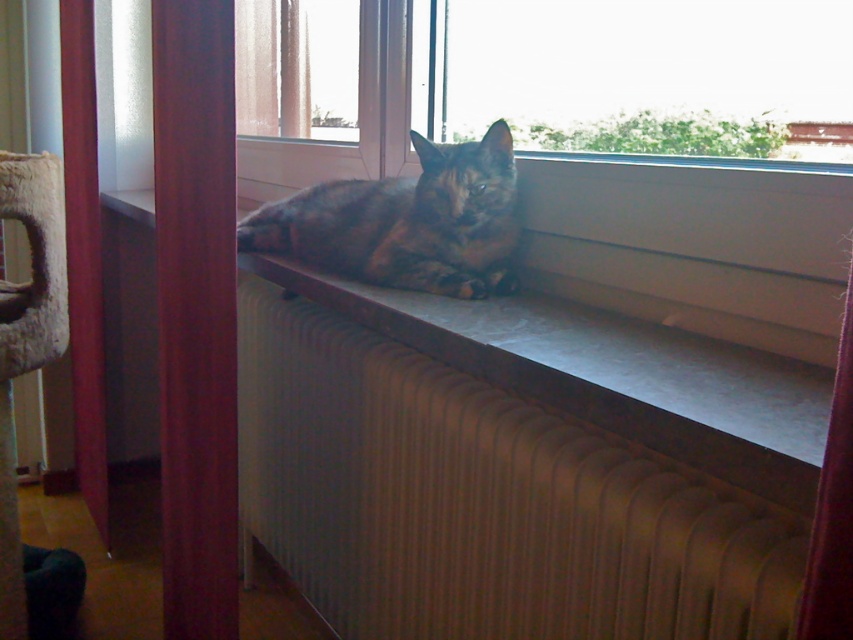
Looking at this image, between metallic radiator at lower center and transparent glass window at upper center, which one appears on the right side from the viewer's perspective?

transparent glass window at upper center is more to the right.

Between point (511, 432) and point (844, 60), which one is positioned behind?

Point (844, 60)

This screenshot has height=640, width=853. Find the location of `metallic radiator at lower center`. metallic radiator at lower center is located at coordinates (485, 500).

In the scene shown: Who is positioned more to the left, tortoiseshell fur cat at window or velvet red curtain at lower right?

tortoiseshell fur cat at window is more to the left.

Describe the element at coordinates (405, 221) in the screenshot. The width and height of the screenshot is (853, 640). I see `tortoiseshell fur cat at window` at that location.

Is point (312, 193) positioned behind point (814, 579)?

That is True.

You are a GUI agent. You are given a task and a screenshot of the screen. Output one action in this format:
    pyautogui.click(x=<x>, y=<y>)
    Task: Click on the tortoiseshell fur cat at window
    The height and width of the screenshot is (640, 853).
    Given the screenshot: What is the action you would take?
    pyautogui.click(x=405, y=221)

Is metallic radiator at lower center smaller than velvet red curtain at lower right?

Incorrect, metallic radiator at lower center is not smaller in size than velvet red curtain at lower right.

Is point (352, 342) positioned behind point (828, 490)?

Yes, it is.

Does point (248, 300) come behind point (848, 616)?

Yes, point (248, 300) is farther from viewer.

Locate an element on the screen. This screenshot has width=853, height=640. metallic radiator at lower center is located at coordinates pyautogui.click(x=485, y=500).